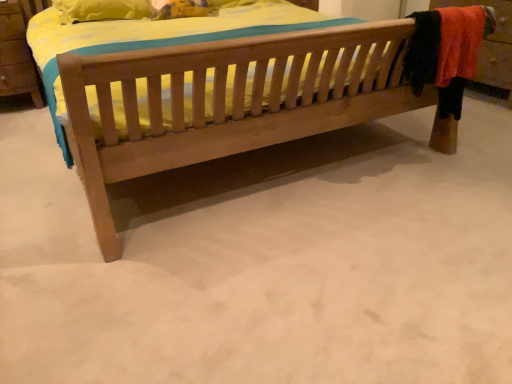
Where is `wooden dresser at right`? The width and height of the screenshot is (512, 384). wooden dresser at right is located at coordinates (492, 49).

Describe the element at coordinates (492, 49) in the screenshot. The width and height of the screenshot is (512, 384). I see `wooden dresser at right` at that location.

What do you see at coordinates (226, 101) in the screenshot? The image size is (512, 384). I see `natural wood bed at center` at bounding box center [226, 101].

You are a GUI agent. You are given a task and a screenshot of the screen. Output one action in this format:
    pyautogui.click(x=<x>, y=<y>)
    Task: Click on the natural wood bed at center
    The image size is (512, 384).
    Given the screenshot: What is the action you would take?
    pyautogui.click(x=226, y=101)

I want to click on wooden dresser at right, so click(x=492, y=49).

In the scene shown: Considering the positions of objects wooden dresser at right and natural wood bed at center in the image provided, who is more to the right, wooden dresser at right or natural wood bed at center?

wooden dresser at right is more to the right.

Is wooden dresser at right positioned before natural wood bed at center?

That is False.

Is point (475, 0) closer to viewer compared to point (297, 57)?

No, (475, 0) is further to viewer.

From the image's perspective, is wooden dresser at right on natural wood bed at center?

Yes, from the image's perspective, wooden dresser at right is over natural wood bed at center.

From a real-world perspective, is wooden dresser at right positioned above or below natural wood bed at center?

Clearly, from a real-world perspective, wooden dresser at right is above natural wood bed at center.

In the scene shown: Does wooden dresser at right have a greater width compared to natural wood bed at center?

In fact, wooden dresser at right might be narrower than natural wood bed at center.

Between wooden dresser at right and natural wood bed at center, which one has more height?

wooden dresser at right.

Between wooden dresser at right and natural wood bed at center, which one has smaller size?

wooden dresser at right is smaller.

Is wooden dresser at right spatially inside natural wood bed at center, or outside of it?

wooden dresser at right is located beyond the bounds of natural wood bed at center.

Is wooden dresser at right not near natural wood bed at center?

wooden dresser at right is positioned a significant distance from natural wood bed at center.

From the picture: Is natural wood bed at center at the back of wooden dresser at right?

wooden dresser at right does not have its back to natural wood bed at center.

Identify the location of bed below the wooden dresser at right (from the image's perspective). This screenshot has height=384, width=512. (226, 101).

Would you say natural wood bed at center is to the left or to the right of wooden dresser at right in the picture?

Clearly, natural wood bed at center is on the left of wooden dresser at right in the image.

Considering the positions of objects natural wood bed at center and wooden dresser at right in the image provided, who is in front, natural wood bed at center or wooden dresser at right?

natural wood bed at center.

Which is behind, point (413, 107) or point (482, 4)?

Positioned behind is point (482, 4).

From the image's perspective, who appears lower, natural wood bed at center or wooden dresser at right?

natural wood bed at center, from the image's perspective.

From a real-world perspective, is natural wood bed at center below wooden dresser at right?

Correct, in the physical world, natural wood bed at center is lower than wooden dresser at right.

Is natural wood bed at center wider than wooden dresser at right?

Indeed, natural wood bed at center has a greater width compared to wooden dresser at right.

Does natural wood bed at center have a lesser height compared to wooden dresser at right?

Correct, natural wood bed at center is not as tall as wooden dresser at right.

Considering the relative sizes of natural wood bed at center and wooden dresser at right in the image provided, is natural wood bed at center bigger than wooden dresser at right?

Indeed, natural wood bed at center has a larger size compared to wooden dresser at right.

Would you say wooden dresser at right is part of natural wood bed at center's contents?

No, wooden dresser at right is not a part of natural wood bed at center.

Is natural wood bed at center directly adjacent to wooden dresser at right?

No, natural wood bed at center is not beside wooden dresser at right.

Is wooden dresser at right at the back of natural wood bed at center?

No, natural wood bed at center's orientation is not away from wooden dresser at right.

How different are the orientations of natural wood bed at center and wooden dresser at right in degrees?

There is a 90.5-degree angle between the facing directions of natural wood bed at center and wooden dresser at right.

How far apart are natural wood bed at center and wooden dresser at right?

natural wood bed at center is 4.52 feet away from wooden dresser at right.

The image size is (512, 384). I want to click on dresser that is behind the natural wood bed at center, so click(492, 49).

This screenshot has height=384, width=512. In order to click on bed lying below the wooden dresser at right (from the image's perspective) in this screenshot , I will do `click(226, 101)`.

Identify the location of dresser above the natural wood bed at center (from the image's perspective). The image size is (512, 384). (492, 49).